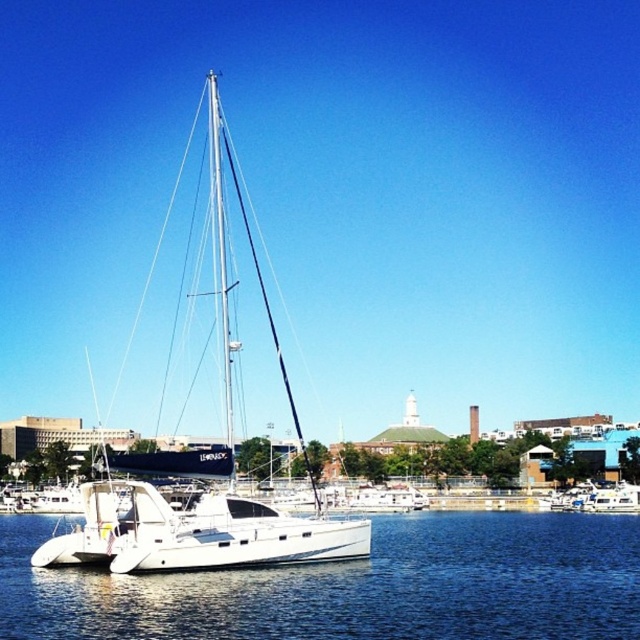
Does clear blue water at center have a smaller size compared to white glossy sailboat at center?

Yes.

Is point (99, 632) less distant than point (186, 467)?

Yes, it is.

Is point (428, 604) farther from camera compared to point (125, 557)?

No.

Where is `clear blue water at center`? This screenshot has width=640, height=640. clear blue water at center is located at coordinates (355, 586).